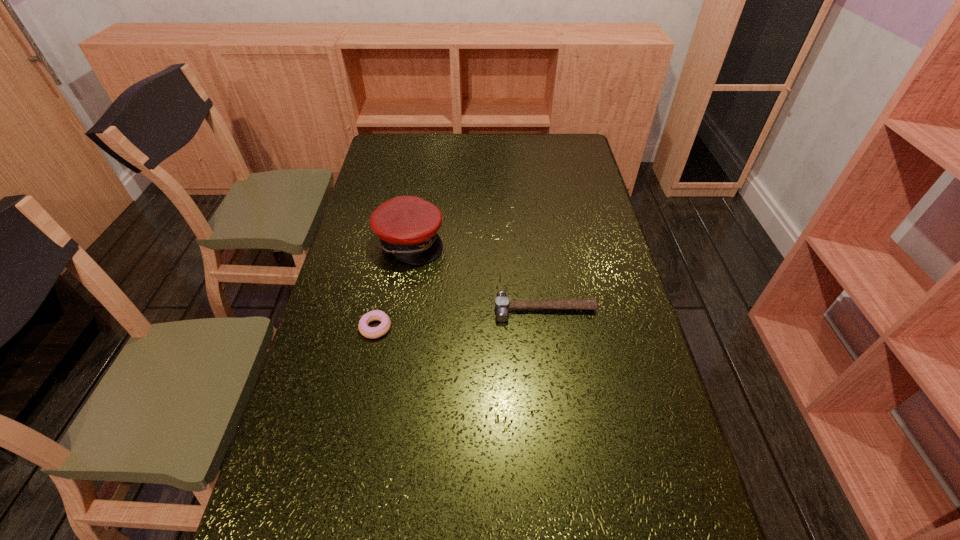
Image resolution: width=960 pixels, height=540 pixels. What are the coordinates of `free space at the far edge` in the screenshot? It's located at (508, 143).

This screenshot has width=960, height=540. What are the coordinates of `blank space at the left edge of the desktop` in the screenshot? It's located at (288, 539).

You are a GUI agent. You are given a task and a screenshot of the screen. Output one action in this format:
    pyautogui.click(x=<x>, y=<y>)
    Task: Click on the vacant region at the right edge of the desktop
    
    Given the screenshot: What is the action you would take?
    (604, 336)

Find the location of a particular element. vacant space at the far left corner is located at coordinates (405, 150).

Where is `vacant space in between the hammer and the cap`? The image size is (960, 540). vacant space in between the hammer and the cap is located at coordinates (477, 275).

The image size is (960, 540). What are the coordinates of `free spot between the cap and the hammer` in the screenshot? It's located at (477, 275).

Image resolution: width=960 pixels, height=540 pixels. What are the coordinates of `vacant point located between the rightmost object and the farthest object` in the screenshot? It's located at (477, 275).

The image size is (960, 540). Identify the location of blank region between the cap and the doughnut. (393, 285).

Where is `free space between the tallest object and the doughnut`? Image resolution: width=960 pixels, height=540 pixels. free space between the tallest object and the doughnut is located at coordinates (393, 285).

Choose which object is the nearest neighbor to the farthest object. Please provide its 2D coordinates. Your answer should be formatted as a tuple, i.e. [(x, y)], where the tuple contains the x and y coordinates of a point satisfying the conditions above.

[(368, 332)]